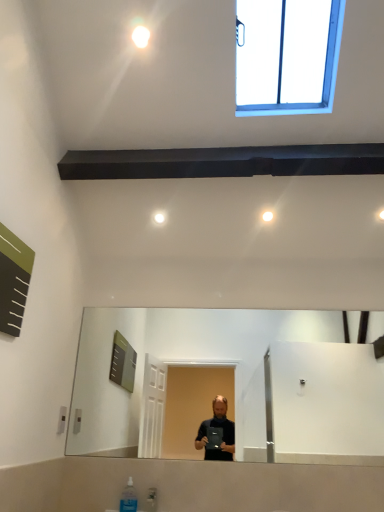
Question: From the image's perspective, is blue plastic window at upper right positioned above or below white glossy light bulb at upper center?

Choices:
 (A) below
 (B) above

Answer: (B)

Question: In terms of size, does blue plastic window at upper right appear bigger or smaller than white glossy light bulb at upper center?

Choices:
 (A) big
 (B) small

Answer: (A)

Question: Which object is the farthest from the blue plastic window at upper right?

Choices:
 (A) clear plastic bottle at lower center
 (B) green matte board at upper left
 (C) white glossy light bulb at upper center

Answer: (A)

Question: Considering the real-world distances, which object is farthest from the green matte board at upper left?

Choices:
 (A) clear plastic bottle at lower center
 (B) blue plastic window at upper right
 (C) white glossy light bulb at upper center

Answer: (B)